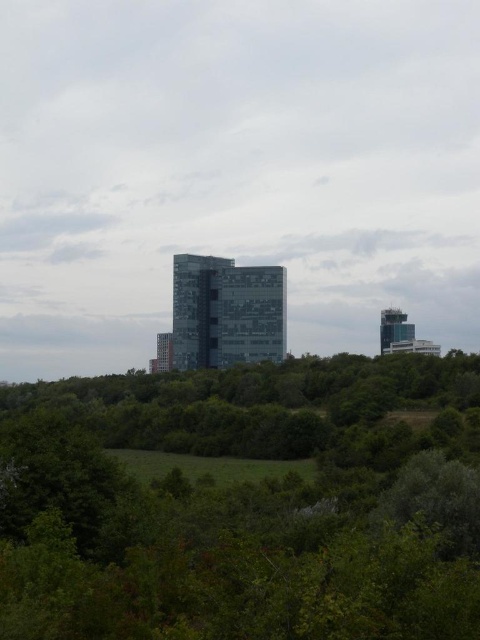
Question: Which object is the farthest from the glassy reflective building at center?

Choices:
 (A) glassy reflective tower at right
 (B) transparent glass tower at center

Answer: (A)

Question: Which of the following is the closest to the observer?

Choices:
 (A) green leafy tree at center
 (B) transparent glass tower at center
 (C) glassy reflective building at center

Answer: (A)

Question: Can you confirm if green leafy tree at center is positioned to the right of glassy reflective tower at right?

Choices:
 (A) yes
 (B) no

Answer: (B)

Question: Considering the relative positions of green leafy tree at center and glassy reflective building at center in the image provided, where is green leafy tree at center located with respect to glassy reflective building at center?

Choices:
 (A) right
 (B) left

Answer: (A)

Question: Observing the image, what is the correct spatial positioning of glassy reflective tower at right in reference to transparent glass tower at center?

Choices:
 (A) right
 (B) left

Answer: (A)

Question: Based on their relative distances, which object is farther from the glassy reflective building at center?

Choices:
 (A) transparent glass tower at center
 (B) green leafy tree at center
 (C) glassy reflective tower at right

Answer: (C)